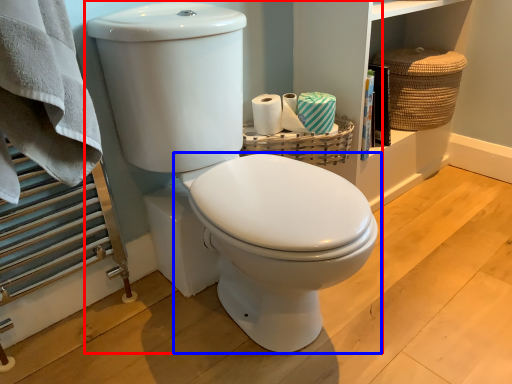
Question: Which of the following is the closest to the observer, toilet (highlighted by a red box) or toilet (highlighted by a blue box)?

Choices:
 (A) toilet
 (B) toilet

Answer: (A)